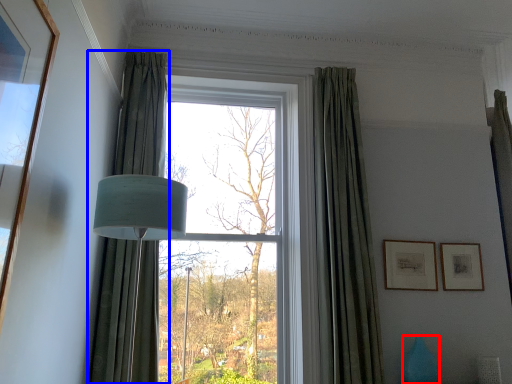
Question: Which of the following is the closest to the observer, vase (highlighted by a red box) or curtain (highlighted by a blue box)?

Choices:
 (A) vase
 (B) curtain

Answer: (B)